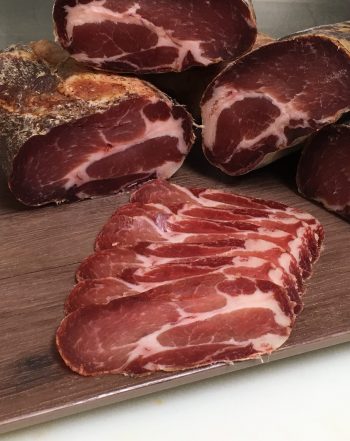
This screenshot has width=350, height=441. I want to click on dark knot on wood, so click(36, 363).